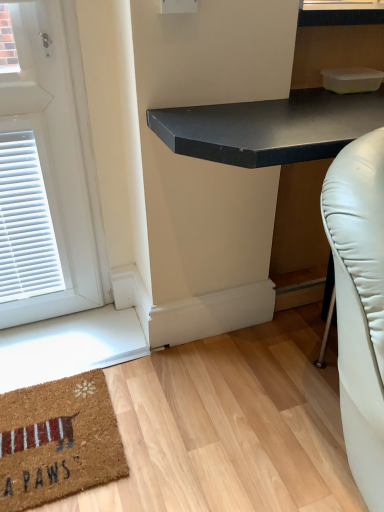
Find the location of a particular element. blank space situated above brown coir mat at lower left (from a real-world perspective) is located at coordinates (62, 422).